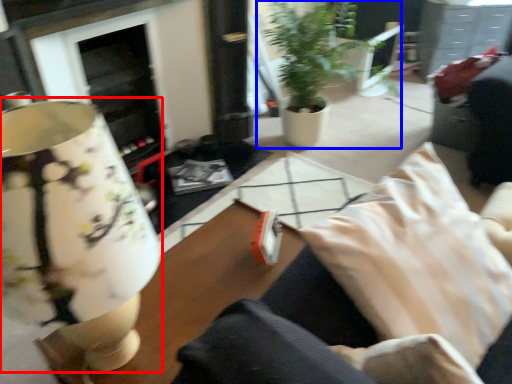
Question: Which of the following is the closest to the observer, table lamp (highlighted by a red box) or houseplant (highlighted by a blue box)?

Choices:
 (A) table lamp
 (B) houseplant

Answer: (A)